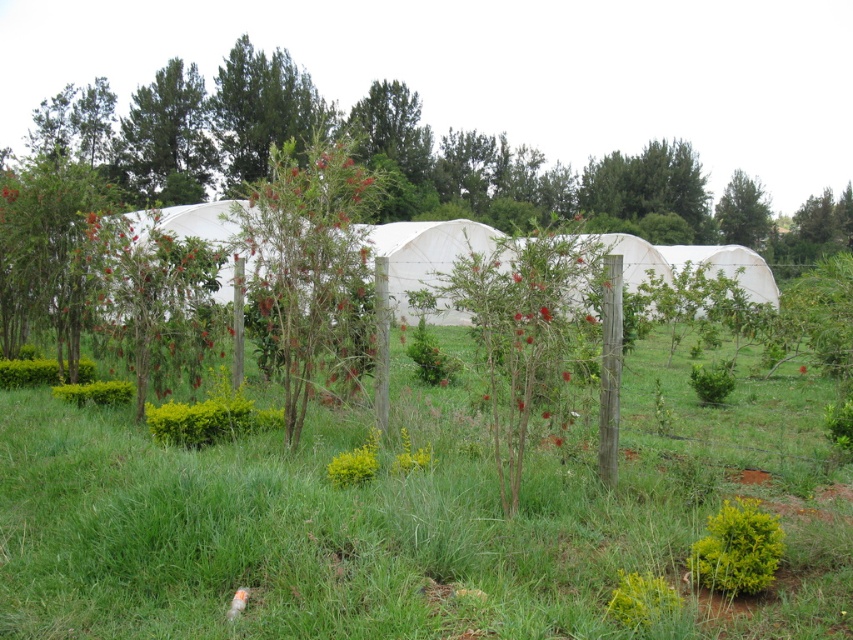
Is point (550, 612) closer to viewer compared to point (590, 316)?

Yes, it is in front of point (590, 316).

Does green grass at center appear on the left side of red matte flower at center?

Incorrect, green grass at center is not on the left side of red matte flower at center.

Identify the location of green grass at center. (413, 518).

Is point (763, 412) in front of point (737, 179)?

Yes, point (763, 412) is in front of point (737, 179).

Is green grass at center bigger than green leafy tree at upper right?

Actually, green grass at center might be smaller than green leafy tree at upper right.

Who is more forward, [456,627] or [740,220]?

Point [456,627] is more forward.

Where is `green grass at center`? This screenshot has height=640, width=853. green grass at center is located at coordinates (413, 518).

Who is more distant from viewer, (x=173, y=131) or (x=721, y=209)?

The point (x=721, y=209) is behind.

Image resolution: width=853 pixels, height=640 pixels. What are the coordinates of `green matte tree at upper left` in the screenshot? It's located at (166, 140).

What do you see at coordinates (166, 140) in the screenshot? I see `green matte tree at upper left` at bounding box center [166, 140].

The height and width of the screenshot is (640, 853). Identify the location of green matte tree at upper left. (166, 140).